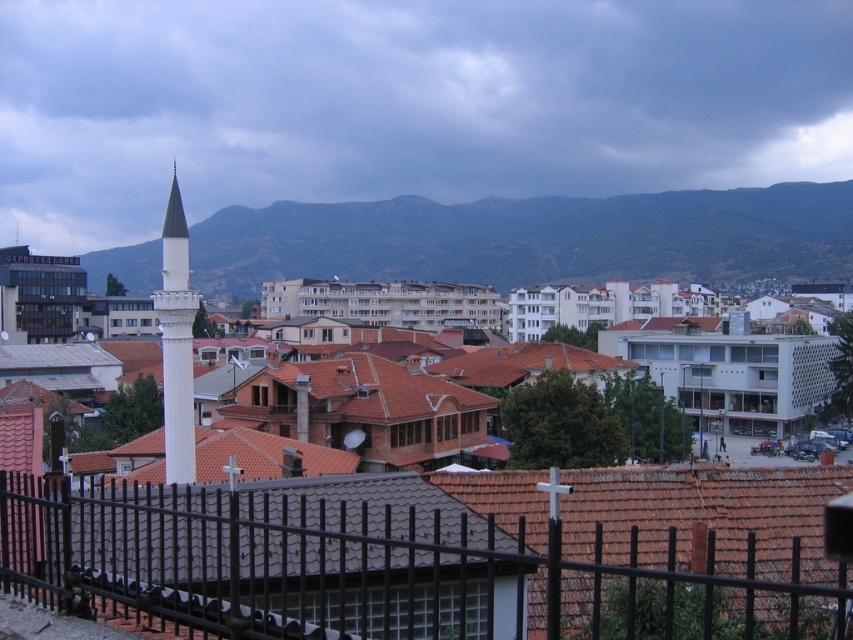
Which is behind, point (570, 256) or point (183, 433)?

The point (570, 256) is more distant.

Can you confirm if green textured mountain at upper center is positioned above white marble minaret at center-left?

Correct, green textured mountain at upper center is located above white marble minaret at center-left.

The height and width of the screenshot is (640, 853). What do you see at coordinates (534, 240) in the screenshot? I see `green textured mountain at upper center` at bounding box center [534, 240].

This screenshot has height=640, width=853. Identify the location of green textured mountain at upper center. (534, 240).

Can you confirm if black metal fence at lower center is smaller than white marble minaret at center-left?

Indeed, black metal fence at lower center has a smaller size compared to white marble minaret at center-left.

Who is lower down, black metal fence at lower center or white marble minaret at center-left?

black metal fence at lower center is lower down.

Locate an element on the screen. This screenshot has width=853, height=640. black metal fence at lower center is located at coordinates (404, 554).

You are a GUI agent. You are given a task and a screenshot of the screen. Output one action in this format:
    pyautogui.click(x=<x>, y=<y>)
    Task: Click on the black metal fence at lower center
    
    Given the screenshot: What is the action you would take?
    pyautogui.click(x=404, y=554)

Can you confirm if black metal fence at lower center is smaller than white smooth minaret at center?

Indeed, black metal fence at lower center has a smaller size compared to white smooth minaret at center.

Is black metal fence at lower center taller than white smooth minaret at center?

Incorrect, black metal fence at lower center's height is not larger of white smooth minaret at center's.

The width and height of the screenshot is (853, 640). Find the location of `black metal fence at lower center`. black metal fence at lower center is located at coordinates (404, 554).